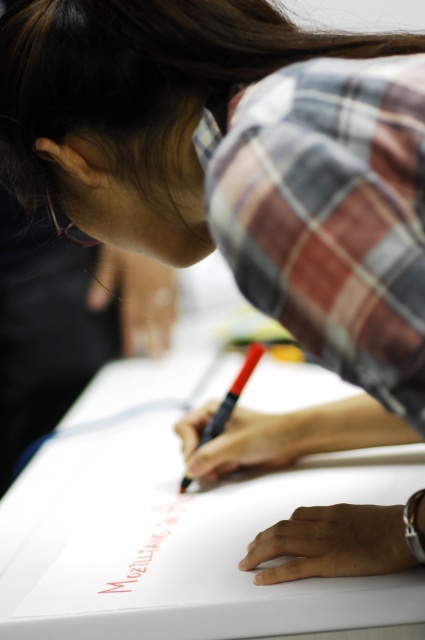
Question: Among these points, which one is nearest to the camera?

Choices:
 (A) (113, 564)
 (B) (6, 560)

Answer: (A)

Question: Does white paper at center appear over pink matte marker at center?

Choices:
 (A) yes
 (B) no

Answer: (A)

Question: Which point is farther from the camera taking this photo?

Choices:
 (A) (150, 611)
 (B) (110, 577)
 (C) (243, 376)

Answer: (C)

Question: Can you confirm if pink matte marker at center is positioned above black matte pen at center?

Choices:
 (A) no
 (B) yes

Answer: (A)

Question: Among these points, which one is nearest to the camera?

Choices:
 (A) (240, 378)
 (B) (127, 518)

Answer: (B)

Question: Does pink matte marker at center have a smaller size compared to black matte pen at center?

Choices:
 (A) yes
 (B) no

Answer: (A)